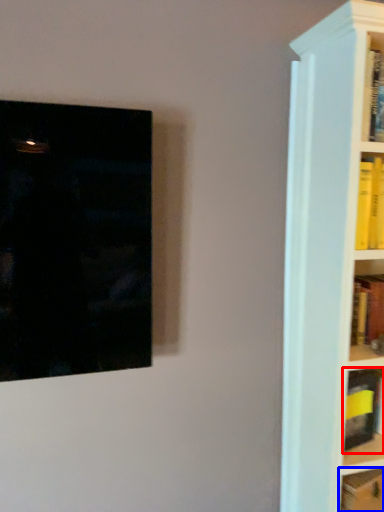
Question: Which object appears closest to the camera in this image, book (highlighted by a red box) or book (highlighted by a blue box)?

Choices:
 (A) book
 (B) book

Answer: (B)